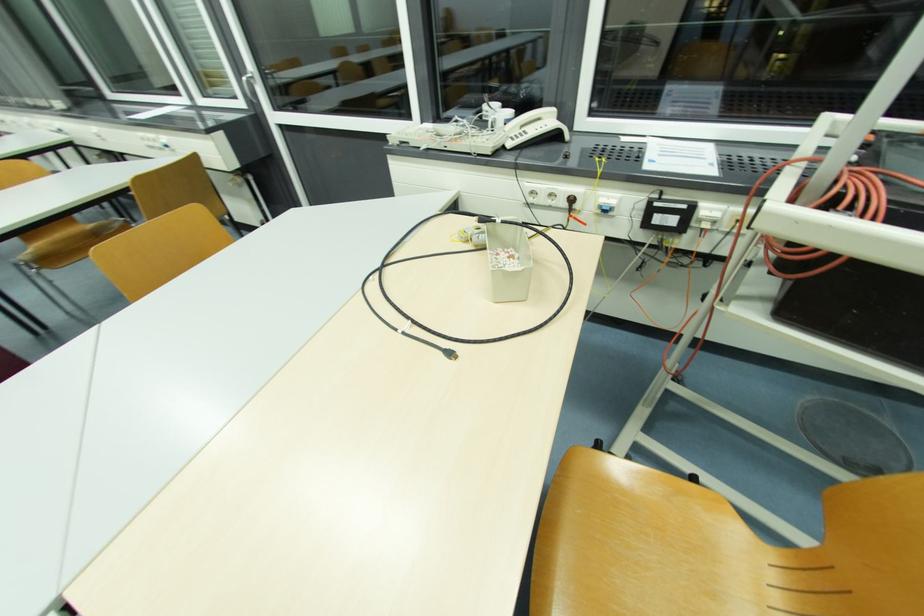
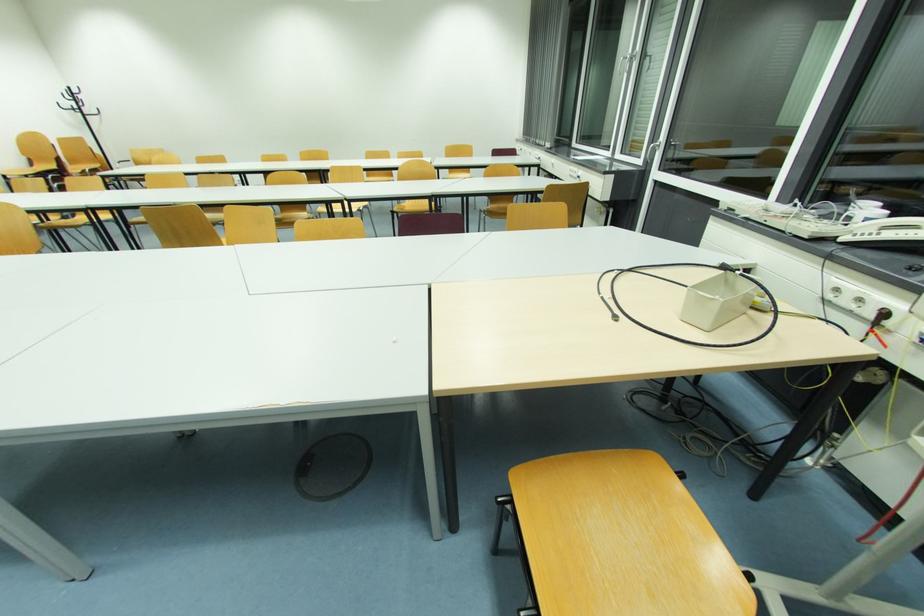
Question: The first image is from the beginning of the video and the second image is from the end. How did the camera likely rotate when shooting the video?

Choices:
 (A) Left
 (B) Right
 (C) Up
 (D) Down

Answer: (A)